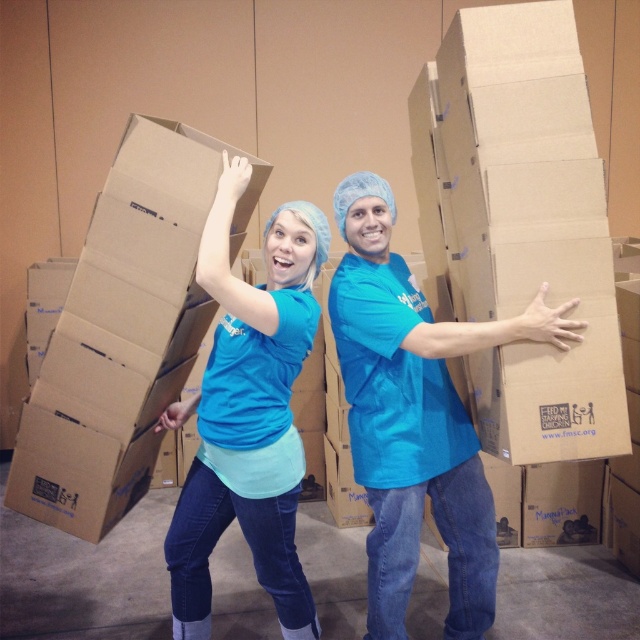
Question: Which of these objects is positioned farthest from the matte blue shirt at center?

Choices:
 (A) blue fabric shirt at center
 (B) brown cardboard box at right

Answer: (B)

Question: Observing the image, what is the correct spatial positioning of brown cardboard box at right in reference to matte blue shirt at center?

Choices:
 (A) below
 (B) above

Answer: (B)

Question: Is brown cardboard box at upper left further to camera compared to matte blue shirt at center?

Choices:
 (A) no
 (B) yes

Answer: (B)

Question: Based on their relative distances, which object is nearer to the matte blue shirt at center?

Choices:
 (A) brown cardboard box at right
 (B) blue fabric shirt at center
 (C) brown cardboard box at upper left

Answer: (C)

Question: Which point is closer to the camera taking this photo?

Choices:
 (A) pyautogui.click(x=417, y=337)
 (B) pyautogui.click(x=234, y=452)
 (C) pyautogui.click(x=584, y=266)

Answer: (C)

Question: Can you confirm if brown cardboard box at upper left is positioned above blue fabric shirt at center?

Choices:
 (A) no
 (B) yes

Answer: (B)